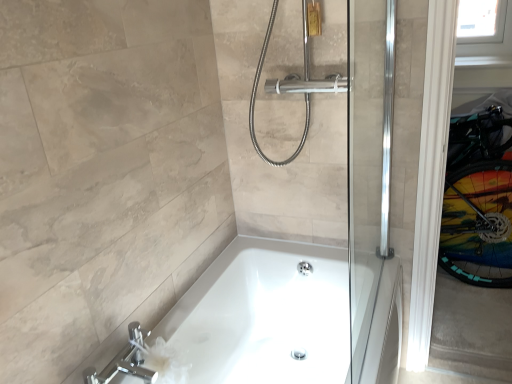
You are a GUI agent. You are given a task and a screenshot of the screen. Output one action in this format:
    pyautogui.click(x=<x>, y=<y>)
    Task: Click on the chrome/metallic faucet at lower left
    
    Given the screenshot: What is the action you would take?
    pyautogui.click(x=125, y=361)

At what (x,y) coordinates should I click in order to perform the action: click on white glossy bathtub at center. Please return your answer as a coordinate pair (x, y). The width and height of the screenshot is (512, 384). Looking at the image, I should click on point(265,316).

From the image's perspective, would you say transparent plastic window screen at upper right is shown under white glossy bathtub at center?

No, from the image's perspective, transparent plastic window screen at upper right is not beneath white glossy bathtub at center.

Is transparent plastic window screen at upper right bigger or smaller than white glossy bathtub at center?

In the image, transparent plastic window screen at upper right appears to be smaller than white glossy bathtub at center.

In terms of height, does transparent plastic window screen at upper right look taller or shorter compared to white glossy bathtub at center?

Answer: In the image, transparent plastic window screen at upper right appears to be shorter than white glossy bathtub at center.

Considering the positions of objects transparent plastic window screen at upper right and white glossy bathtub at center in the image provided, who is in front, transparent plastic window screen at upper right or white glossy bathtub at center?

white glossy bathtub at center is closer to the camera.

In order to click on window screen positioned vertically above the chrome/metallic faucet at lower left (from a real-world perspective) in this screenshot , I will do `click(481, 21)`.

Is chrome/metallic faucet at lower left completely or partially inside transparent plastic window screen at upper right?

Definitely not — chrome/metallic faucet at lower left is not inside transparent plastic window screen at upper right.

Can you confirm if transparent plastic window screen at upper right is wider than chrome/metallic faucet at lower left?

No.

From the image's perspective, does transparent plastic window screen at upper right appear lower than chrome/metallic faucet at lower left?

No.

Who is more distant, white glossy bathtub at center or transparent plastic window screen at upper right?

Positioned behind is transparent plastic window screen at upper right.

Are white glossy bathtub at center and transparent plastic window screen at upper right located far from each other?

Indeed, white glossy bathtub at center is not near transparent plastic window screen at upper right.

From a real-world perspective, is chrome/metallic faucet at lower left located beneath white glossy bathtub at center?

No.

Is the position of chrome/metallic faucet at lower left more distant than that of white glossy bathtub at center?

Yes, the depth of chrome/metallic faucet at lower left is greater than that of white glossy bathtub at center.

Identify the location of tap that appears above the white glossy bathtub at center (from a real-world perspective). Image resolution: width=512 pixels, height=384 pixels. (125, 361).

Considering the points (134, 367) and (280, 274), which point is in front, point (134, 367) or point (280, 274)?

The point (134, 367) is closer.

Is point (150, 379) less distant than point (486, 25)?

That is True.

Which is behind, chrome/metallic faucet at lower left or transparent plastic window screen at upper right?

Positioned behind is transparent plastic window screen at upper right.

From the image's perspective, which is above, chrome/metallic faucet at lower left or transparent plastic window screen at upper right?

From the image's view, transparent plastic window screen at upper right is above.

Could you tell me if chrome/metallic faucet at lower left is turned towards transparent plastic window screen at upper right?

No, chrome/metallic faucet at lower left is not turned towards transparent plastic window screen at upper right.

Looking at this image, does white glossy bathtub at center have a greater width compared to chrome/metallic faucet at lower left?

Correct, the width of white glossy bathtub at center exceeds that of chrome/metallic faucet at lower left.

Is white glossy bathtub at center facing away from chrome/metallic faucet at lower left?

That's not correct — white glossy bathtub at center is not looking away from chrome/metallic faucet at lower left.

Consider the image. From the image's perspective, does white glossy bathtub at center appear lower than chrome/metallic faucet at lower left?

Indeed, from the image's perspective, white glossy bathtub at center is shown beneath chrome/metallic faucet at lower left.

Locate an element on the screen. bathtub below the transparent plastic window screen at upper right (from a real-world perspective) is located at coordinates (265, 316).

Image resolution: width=512 pixels, height=384 pixels. I want to click on window screen behind the chrome/metallic faucet at lower left, so click(481, 21).

Considering their positions, is transparent plastic window screen at upper right positioned closer to white glossy bathtub at center than chrome/metallic faucet at lower left?

chrome/metallic faucet at lower left lies closer to white glossy bathtub at center than the other object.

Considering their positions, is transparent plastic window screen at upper right positioned closer to chrome/metallic faucet at lower left than white glossy bathtub at center?

white glossy bathtub at center.

When comparing their distances from white glossy bathtub at center, does chrome/metallic faucet at lower left or transparent plastic window screen at upper right seem closer?

chrome/metallic faucet at lower left.

When comparing their distances from transparent plastic window screen at upper right, does white glossy bathtub at center or chrome/metallic faucet at lower left seem further?

chrome/metallic faucet at lower left lies further to transparent plastic window screen at upper right than the other object.

Based on the photo, from the image, which object appears to be nearer to chrome/metallic faucet at lower left, white glossy bathtub at center or transparent plastic window screen at upper right?

Among the two, white glossy bathtub at center is located nearer to chrome/metallic faucet at lower left.

From the image, which object appears to be farther from transparent plastic window screen at upper right, chrome/metallic faucet at lower left or white glossy bathtub at center?

chrome/metallic faucet at lower left is positioned further to the anchor transparent plastic window screen at upper right.

Locate an element on the screen. tap between transparent plastic window screen at upper right and white glossy bathtub at center in the up-down direction is located at coordinates (125, 361).